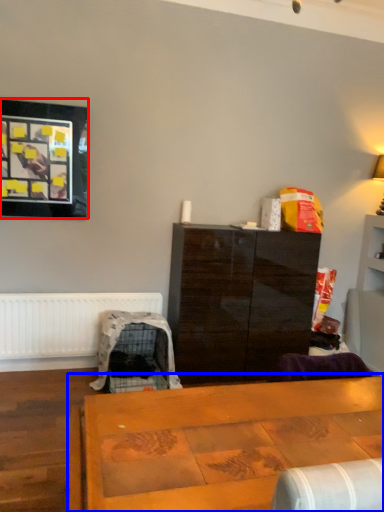
Question: Which point is further to the camera, picture frame (highlighted by a red box) or table (highlighted by a blue box)?

Choices:
 (A) picture frame
 (B) table

Answer: (A)